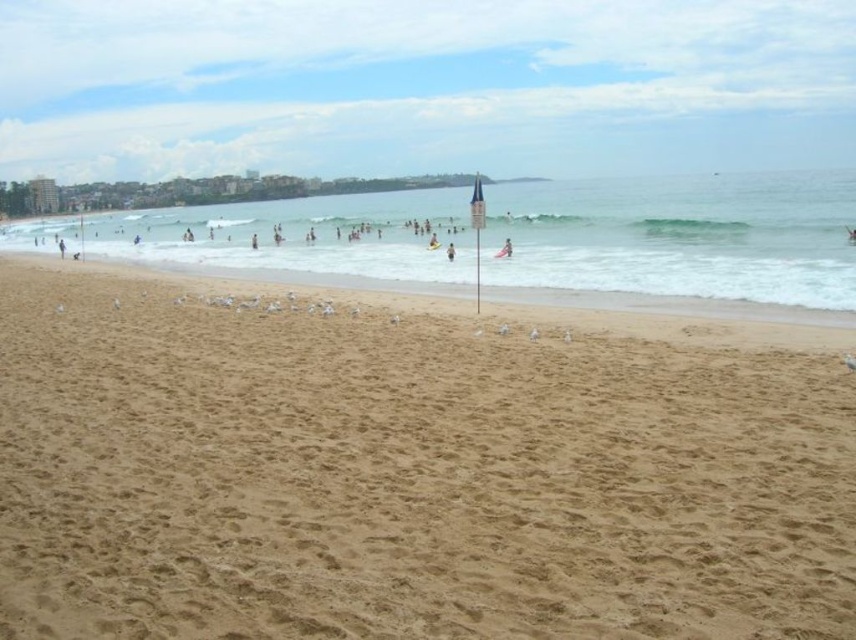
You are a swimmer looking to retrieve a yellow rubber ring at center from the clear blue water at center. Which direction should you swim to reach the ring first?

The clear blue water at center is positioned on the right side of yellow rubber ring at center, so you should swim to the left to reach the yellow rubber ring at center first.

You are a swimmer who wants to swim to the clear blue water at center. Based on the coordinates provided, can you estimate how far you need to swim from the shore?

The clear blue water at center is located at coordinates point [681,236], which is approximately 370 meters from the shore if the image scale is 1 unit equals 1 kilometer. However, without knowing the actual scale of the image, it is impossible to determine the exact distance. Please check the scale before deciding.